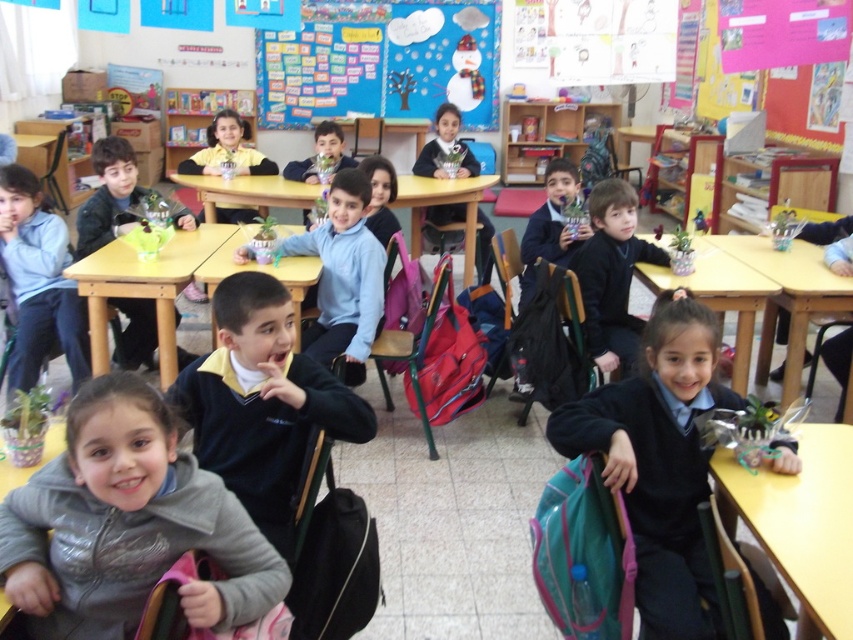
Based on the photo, you are a photographer standing next to a camera. You want to take a picture of the black school uniform at lower right. Can you do so without moving the camera?

The black school uniform at lower right and camera are 1.65 meters apart from each other. Since the camera is within a reasonable distance for photography, you can take the picture without moving the camera.

You are a teacher organizing a classroom activity and need to place a new poster on the wall. You have a dark blue sweater at center and a wooden table at lower right in your view. Which object takes up more space in the classroom?

The wooden table at lower right takes up more space than the dark blue sweater at center because the dark blue sweater at center occupies less space than wooden table at lower right.

You are a teacher observing the classroom. You notice a dark blue sweater at center and a wooden table at lower right. Which object is located lower in the image?

The dark blue sweater at center is positioned under the wooden table at lower right, so the wooden table at lower right is located lower in the image.